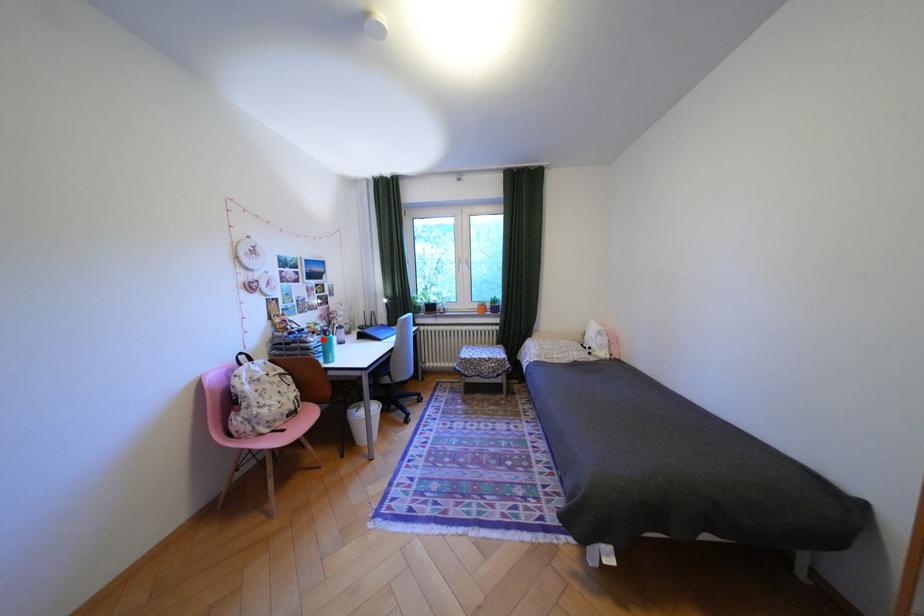
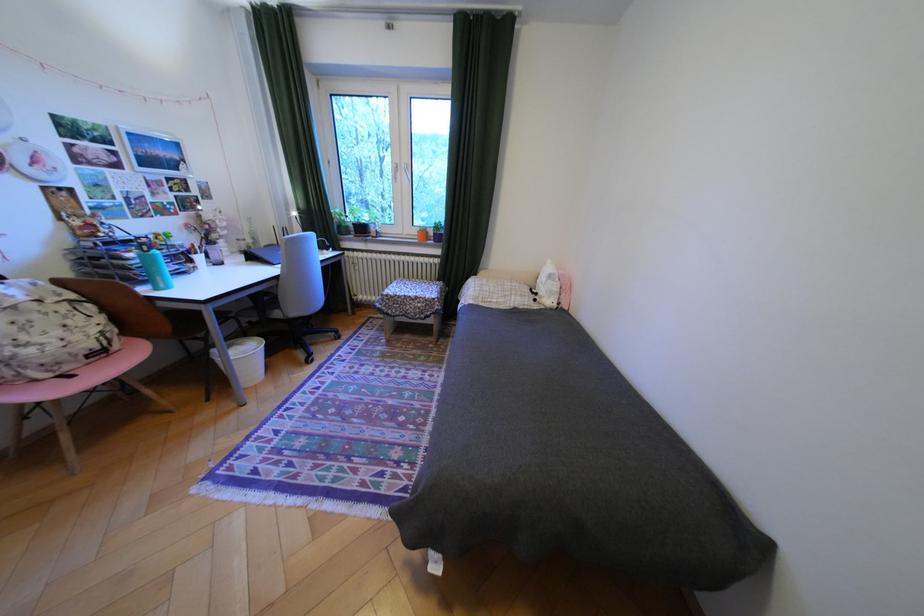
Question: A red point is marked in image1. In image2, is the corresponding 3D point closer to the camera or farther? Reply with the corresponding letter.

Choices:
 (A) The corresponding 3D point is closer.
 (B) The corresponding 3D point is farther.

Answer: (B)